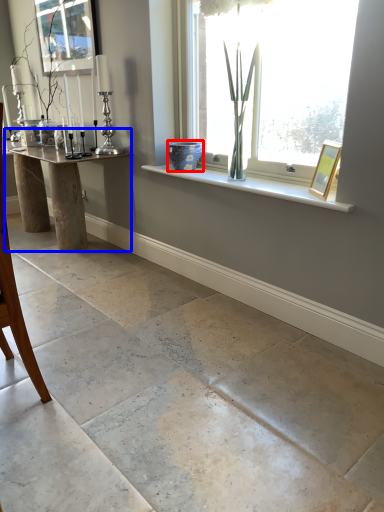
Question: Which point is closer to the camera, glass vase (highlighted by a red box) or table (highlighted by a blue box)?

Choices:
 (A) glass vase
 (B) table

Answer: (A)